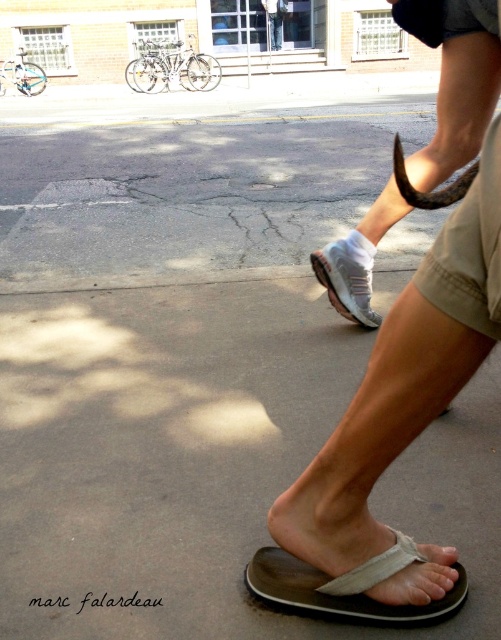
Does gray fabric sandal at lower center appear on the right side of white mesh shoe at center?

No, gray fabric sandal at lower center is not to the right of white mesh shoe at center.

Is point (314, 580) closer to camera compared to point (339, 307)?

Yes, it is.

Is point (426, 611) positioned in front of point (369, 260)?

That is True.

Locate an element on the screen. The height and width of the screenshot is (640, 501). gray fabric sandal at lower center is located at coordinates (347, 586).

What do you see at coordinates (454, 80) in the screenshot?
I see `white fabric sock at upper center` at bounding box center [454, 80].

Consider the image. Is the position of white fabric sock at upper center less distant than that of white mesh shoe at center?

Yes, it is.

Is point (444, 96) farther from camera compared to point (363, 321)?

No, (444, 96) is in front of (363, 321).

Identify the location of white fabric sock at upper center. (454, 80).

Between white fabric sock at upper center and gray fabric sandal at lower center, which one is positioned higher?

white fabric sock at upper center is higher up.

Is white fabric sock at upper center bigger than gray fabric sandal at lower center?

Indeed, white fabric sock at upper center has a larger size compared to gray fabric sandal at lower center.

The image size is (501, 640). Describe the element at coordinates (454, 80) in the screenshot. I see `white fabric sock at upper center` at that location.

Find the location of a particular element. The height and width of the screenshot is (640, 501). white fabric sock at upper center is located at coordinates (454, 80).